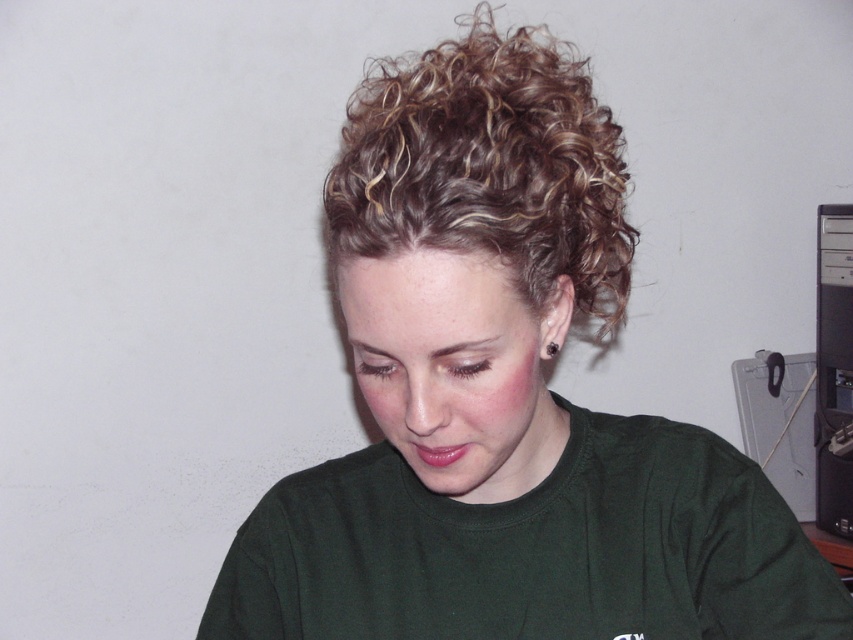
Question: Is curly blonde hair at upper center bigger than black plastic computer tower at right?

Choices:
 (A) yes
 (B) no

Answer: (A)

Question: Does curly blonde hair at upper center appear over black plastic computer tower at right?

Choices:
 (A) yes
 (B) no

Answer: (A)

Question: Can you confirm if curly blonde hair at upper center is thinner than black plastic computer tower at right?

Choices:
 (A) no
 (B) yes

Answer: (A)